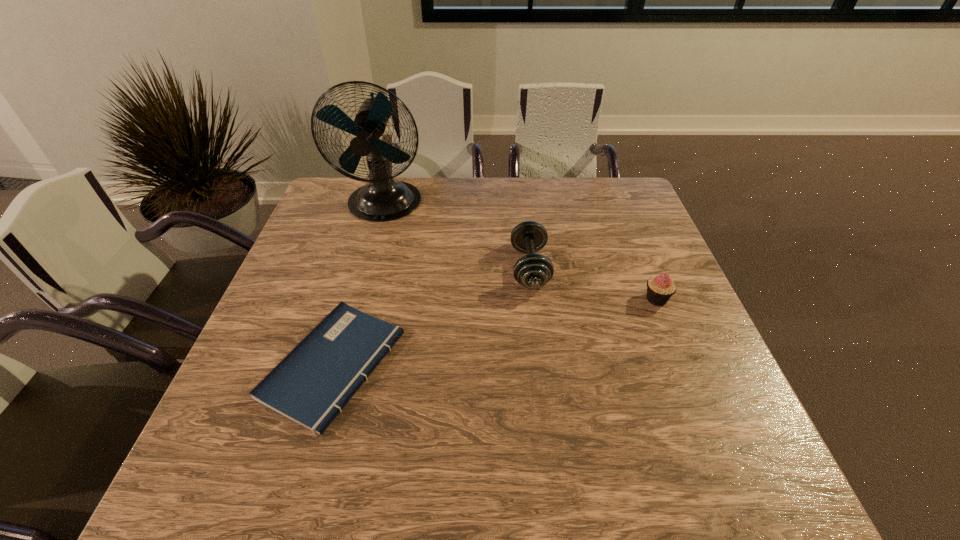
Where is `vacant space at the near right corner`? vacant space at the near right corner is located at coordinates (712, 467).

Locate an element on the screen. The width and height of the screenshot is (960, 540). vacant space that's between the shortest object and the tallest object is located at coordinates (359, 285).

At what (x,y) coordinates should I click in order to perform the action: click on free space that is in between the dumbbell and the farthest object. Please return your answer as a coordinate pair (x, y). This screenshot has height=540, width=960. Looking at the image, I should click on (457, 236).

Where is `vacant region between the shortest object and the second object from right to left`? vacant region between the shortest object and the second object from right to left is located at coordinates (432, 316).

Identify the location of unoccupied position between the dumbbell and the paperback book. The width and height of the screenshot is (960, 540). (432, 316).

This screenshot has height=540, width=960. I want to click on vacant area that lies between the shortest object and the dumbbell, so click(x=432, y=316).

In order to click on unoccupied position between the tallest object and the dumbbell in this screenshot , I will do `click(457, 236)`.

The image size is (960, 540). Find the location of `free space between the paperback book and the rightmost object`. free space between the paperback book and the rightmost object is located at coordinates (495, 332).

Where is `free space between the paperback book and the cupcake`? Image resolution: width=960 pixels, height=540 pixels. free space between the paperback book and the cupcake is located at coordinates (495, 332).

Identify the location of vacant space that's between the dumbbell and the tallest object. (457, 236).